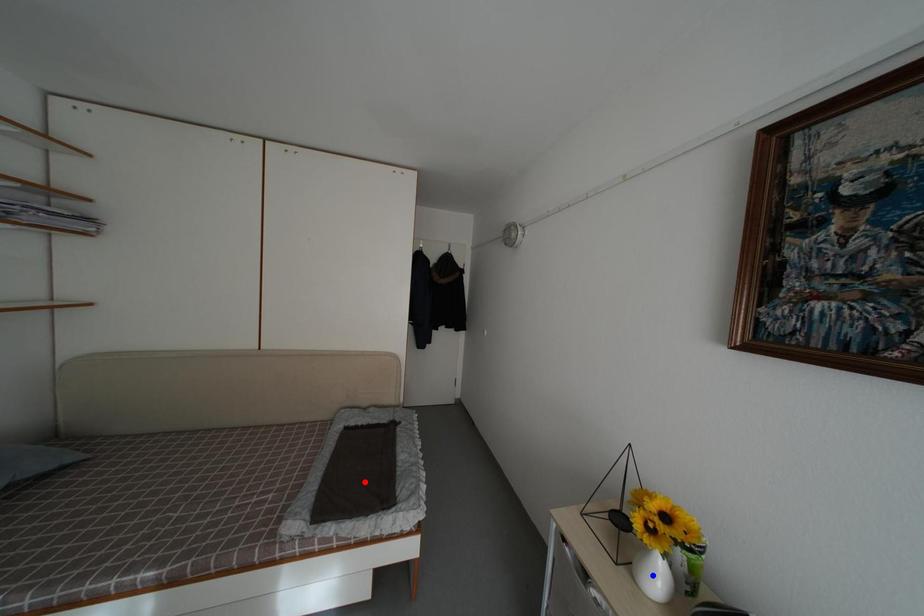
Question: In the image, two points are highlighted. Which point is nearer to the camera? Reply with the corresponding letter.

Choices:
 (A) blue point
 (B) red point

Answer: (A)